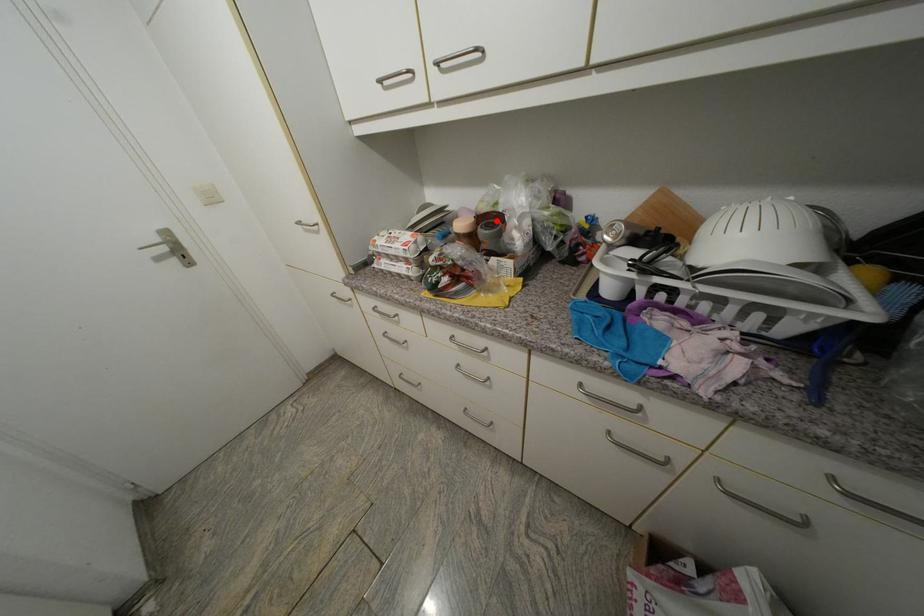
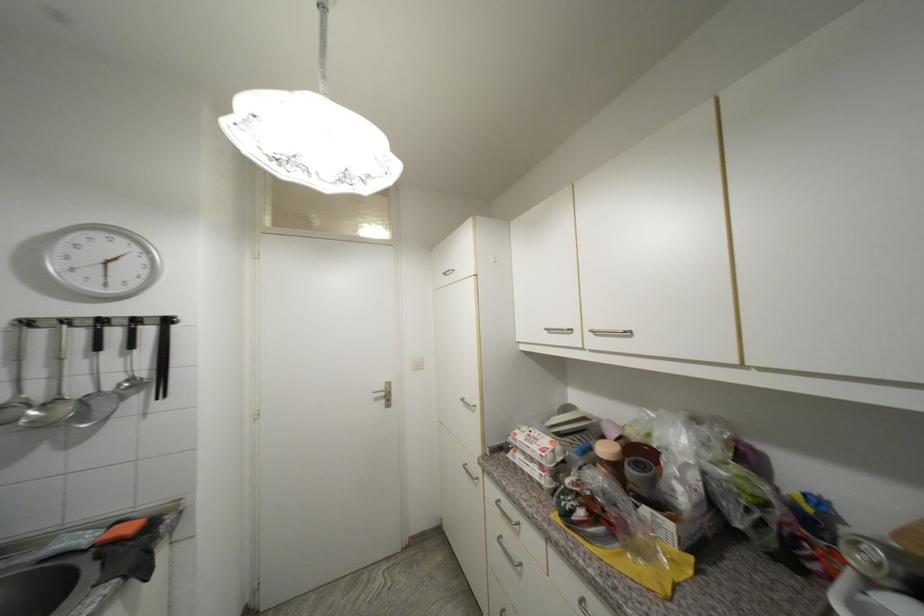
Locate, in the second image, the point that corresponds to the highlighted location in the first image.

(648, 456)